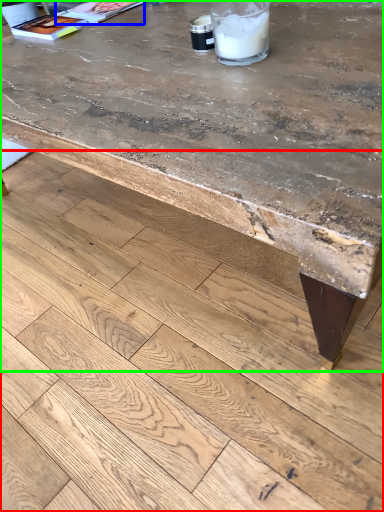
Question: Based on their relative distances, which object is nearer to concrete (highlighted by a red box)? Choose from magazine (highlighted by a blue box) and table (highlighted by a green box).

Choices:
 (A) magazine
 (B) table

Answer: (B)